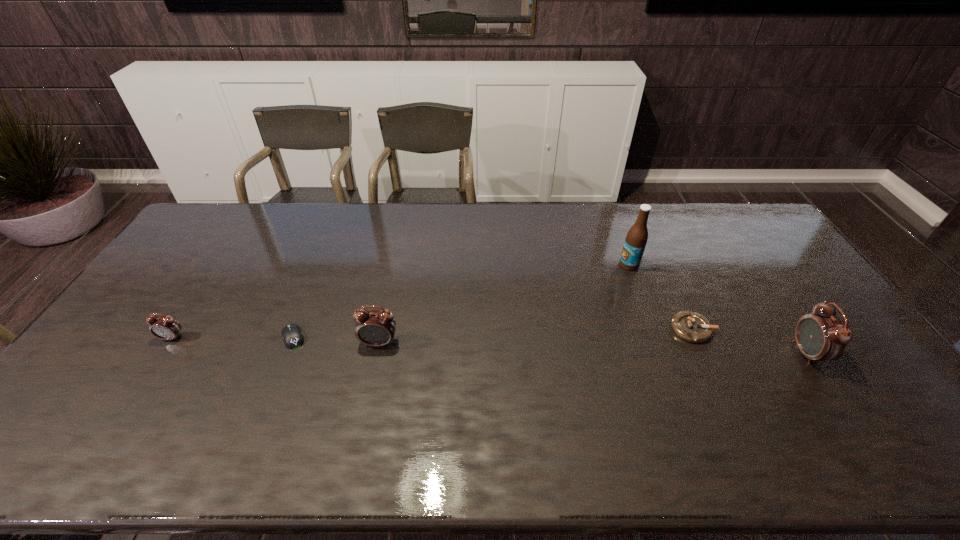
Where is `the leftmost alarm clock`? The height and width of the screenshot is (540, 960). the leftmost alarm clock is located at coordinates [164, 327].

Locate an element on the screen. the shortest alarm clock is located at coordinates (164, 327).

Identify the location of the third object from left to right. (375, 328).

Find the location of a particular element. This screenshot has width=960, height=540. the fourth shortest object is located at coordinates (375, 328).

Find the location of a particular element. Image resolution: width=960 pixels, height=540 pixels. the rightmost alarm clock is located at coordinates (821, 336).

Find the location of a particular element. This screenshot has width=960, height=540. beer bottle is located at coordinates (637, 236).

This screenshot has width=960, height=540. Find the location of `the fourth object from left to right`. the fourth object from left to right is located at coordinates (637, 236).

I want to click on computer equipment, so click(x=292, y=335).

This screenshot has height=540, width=960. In order to click on ashtray in this screenshot , I will do `click(692, 327)`.

Locate an element on the screen. The height and width of the screenshot is (540, 960). vacant position located 0.090m on the face of the shortest alarm clock is located at coordinates (152, 369).